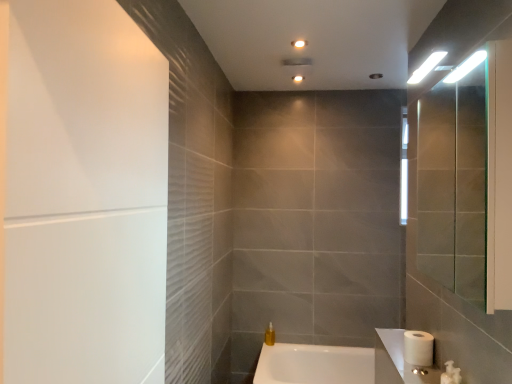
Question: Does matte white ceiling light at upper center appear on the right side of translucent yellow liquid at lower center?

Choices:
 (A) yes
 (B) no

Answer: (A)

Question: Is matte white ceiling light at upper center next to translucent yellow liquid at lower center?

Choices:
 (A) yes
 (B) no

Answer: (B)

Question: Is matte white ceiling light at upper center located outside translucent yellow liquid at lower center?

Choices:
 (A) yes
 (B) no

Answer: (A)

Question: Is matte white ceiling light at upper center smaller than translucent yellow liquid at lower center?

Choices:
 (A) no
 (B) yes

Answer: (B)

Question: Does matte white ceiling light at upper center have a larger size compared to translucent yellow liquid at lower center?

Choices:
 (A) yes
 (B) no

Answer: (B)

Question: Is white glossy bathtub at lower center taller or shorter than matte white ceiling light at upper center?

Choices:
 (A) short
 (B) tall

Answer: (B)

Question: Choose the correct answer: Is white glossy bathtub at lower center inside matte white ceiling light at upper center or outside it?

Choices:
 (A) outside
 (B) inside

Answer: (A)

Question: Is point (307, 369) positioned closer to the camera than point (296, 82)?

Choices:
 (A) farther
 (B) closer

Answer: (A)

Question: From the image's perspective, relative to matte white ceiling light at upper center, is white glossy bathtub at lower center above or below?

Choices:
 (A) above
 (B) below

Answer: (B)

Question: Does point (30, 284) appear closer or farther from the camera than point (410, 337)?

Choices:
 (A) farther
 (B) closer

Answer: (B)

Question: In terms of width, does white matte screen door at left look wider or thinner when compared to white matte toilet paper at lower right?

Choices:
 (A) thin
 (B) wide

Answer: (B)

Question: From a real-world perspective, is white matte screen door at left positioned above or below white matte toilet paper at lower right?

Choices:
 (A) above
 (B) below

Answer: (A)

Question: In terms of size, does white matte screen door at left appear bigger or smaller than white matte toilet paper at lower right?

Choices:
 (A) small
 (B) big

Answer: (B)

Question: Is translucent yellow liquid at lower center taller or shorter than white glossy bathtub at lower center?

Choices:
 (A) short
 (B) tall

Answer: (A)

Question: From the image's perspective, is translucent yellow liquid at lower center positioned above or below white glossy bathtub at lower center?

Choices:
 (A) above
 (B) below

Answer: (A)